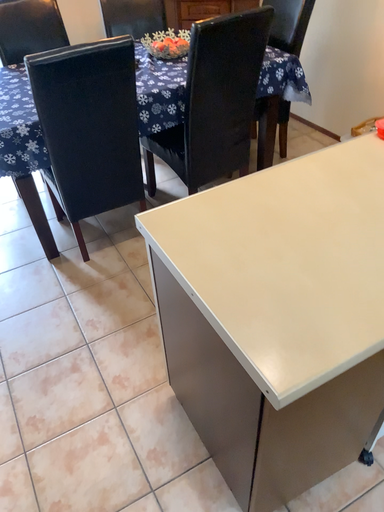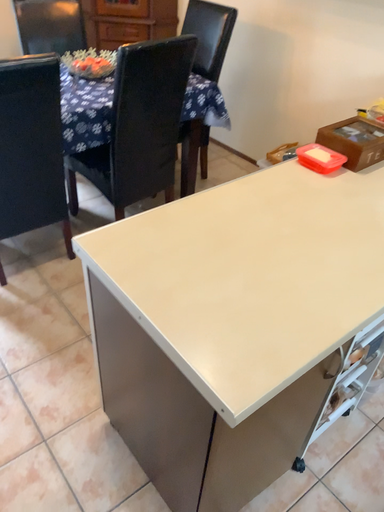
Question: Which way did the camera rotate in the video?

Choices:
 (A) rotated right
 (B) rotated left

Answer: (A)